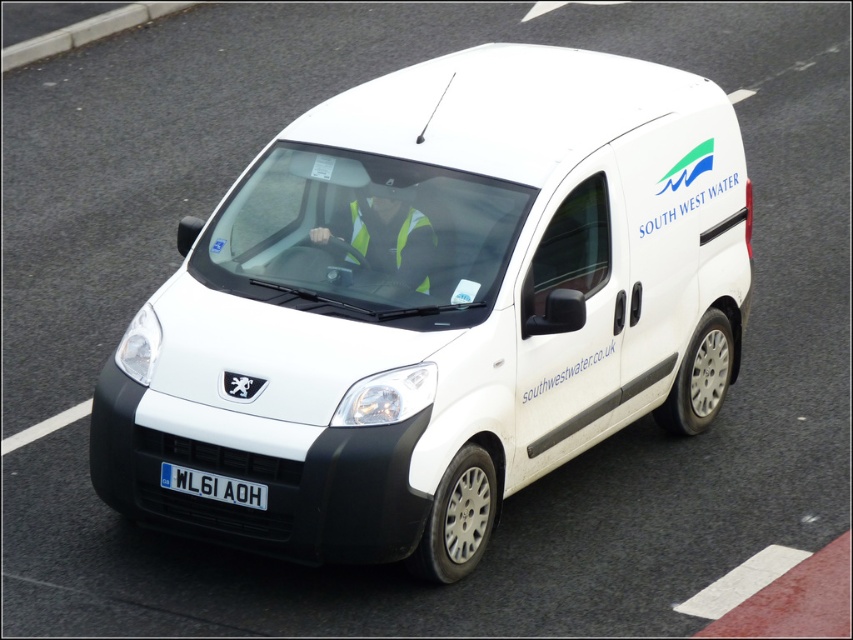
What are the coordinates of the white matte van at center?

The coordinates of the white matte van at center are at point (438,307).

You are standing on the side of the road and see the white matte van at center. If your eyes are 1.6 meters above the ground, can you estimate how far the van is from you?

The white matte van at center is 5.97 meters away from the viewer, so yes, the van is approximately 6 meters away from you.

You are a pedestrian standing on the sidewalk and see the white matte van at center and the reflective yellow vest at center. Which object takes up more space in the image?

The white matte van at center is larger in size than the reflective yellow vest at center, so it takes up more space in the image.